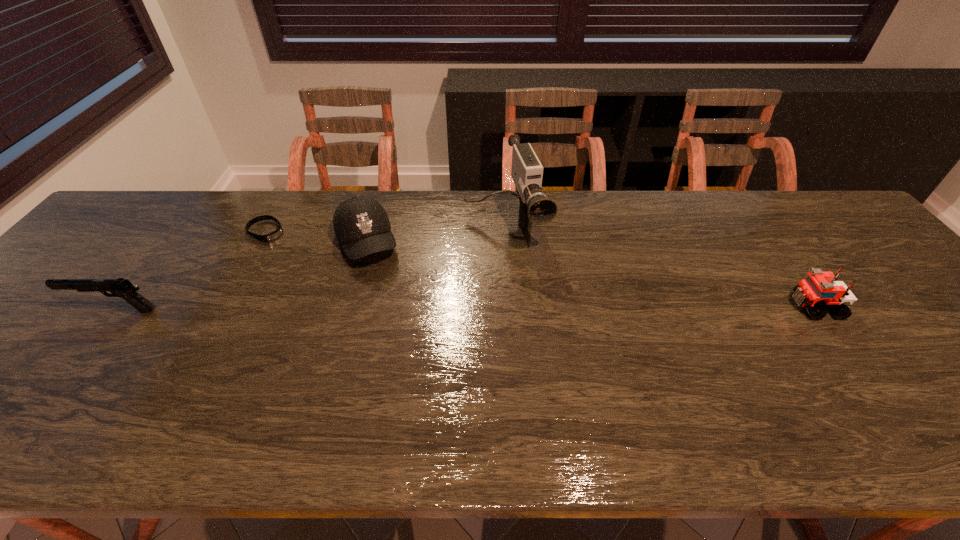
Find the location of `the leftmost object`. the leftmost object is located at coordinates (123, 288).

The image size is (960, 540). Identify the location of the rightmost object. (820, 290).

You are a GUI agent. You are given a task and a screenshot of the screen. Output one action in this format:
    pyautogui.click(x=<x>, y=<y>)
    Task: Click on the third object from right to left
    This screenshot has width=960, height=540.
    Given the screenshot: What is the action you would take?
    (x=361, y=224)

Where is `camcorder`? camcorder is located at coordinates (535, 208).

At what (x,y) coordinates should I click in order to perform the action: click on the second object from right to left. Please return your answer as a coordinate pair (x, y). Looking at the image, I should click on (535, 208).

The image size is (960, 540). In order to click on wristband in this screenshot , I will do click(x=278, y=232).

Locate an element on the screen. This screenshot has height=540, width=960. the fourth object from right to left is located at coordinates (278, 232).

Image resolution: width=960 pixels, height=540 pixels. I want to click on blank area located 0.120m at the aiming end of the gun, so click(25, 310).

Image resolution: width=960 pixels, height=540 pixels. I want to click on vacant space situated 0.080m at the aiming end of the gun, so click(41, 310).

The height and width of the screenshot is (540, 960). In order to click on free space located on the front-facing side of the rightmost object in this screenshot , I will do `click(734, 307)`.